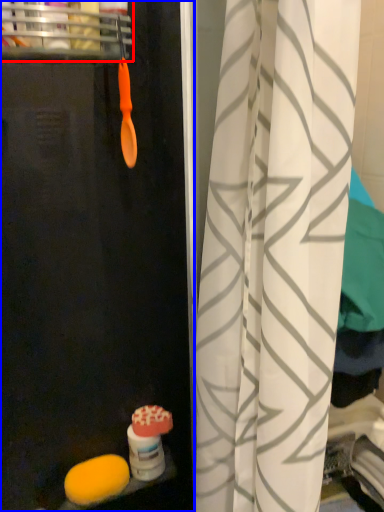
Question: Among these objects, which one is nearest to the camera, shelf (highlighted by a red box) or screen door (highlighted by a blue box)?

Choices:
 (A) shelf
 (B) screen door

Answer: (B)